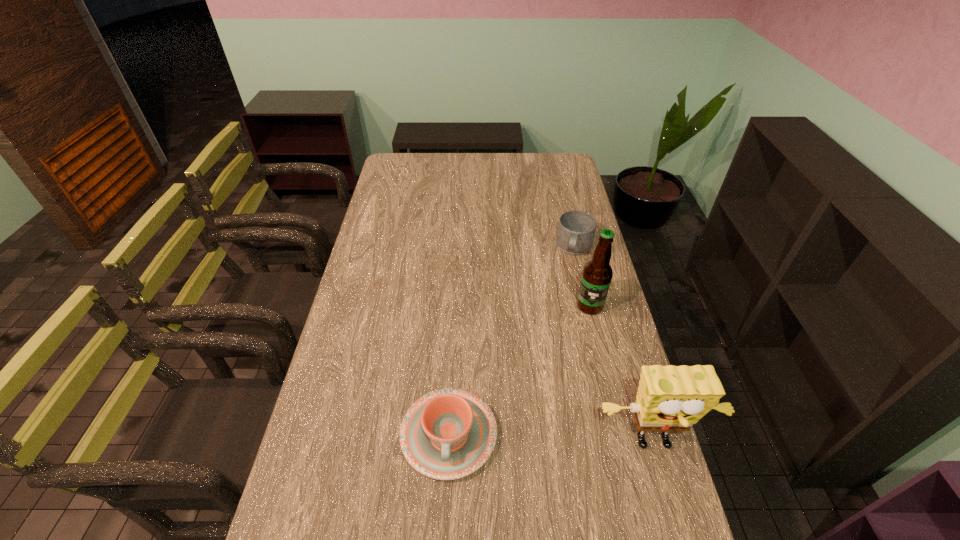
Image resolution: width=960 pixels, height=540 pixels. I want to click on free region located 0.380m on the side of the farthest object with the handle, so pos(553,341).

The image size is (960, 540). I want to click on vacant area located on the side of the farthest object with the handle, so click(567, 285).

Identify the location of sponge that is at the right edge. The image size is (960, 540). (670, 398).

You are a GUI agent. You are given a task and a screenshot of the screen. Output one action in this format:
    pyautogui.click(x=<x>, y=<y>)
    Task: Click on the beer bottle that is at the right edge
    
    Given the screenshot: What is the action you would take?
    (597, 274)

This screenshot has width=960, height=540. Identify the location of mug that is at the right edge. (576, 230).

Locate an element on the screen. This screenshot has height=540, width=960. free spot at the far edge of the desktop is located at coordinates (425, 176).

The image size is (960, 540). Identify the location of vacant space at the near edge. (542, 508).

The image size is (960, 540). I want to click on free space at the left edge, so click(385, 307).

Identify the location of vacant space at the right edge of the desktop. (605, 310).

The image size is (960, 540). I want to click on vacant area at the far left corner of the desktop, so [397, 159].